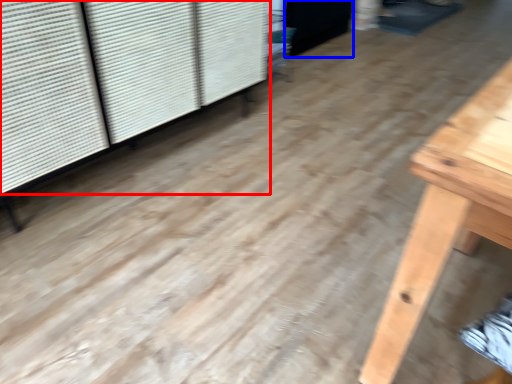
Question: Which object is further to the camera taking this photo, shutter (highlighted by a red box) or screen door (highlighted by a blue box)?

Choices:
 (A) shutter
 (B) screen door

Answer: (B)